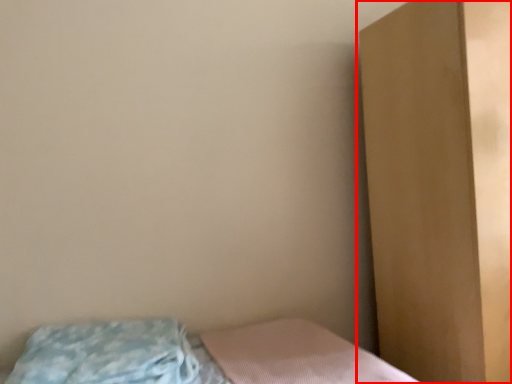
Question: From the image's perspective, what is the correct spatial positioning of dresser (annotated by the red box) in reference to pillow?

Choices:
 (A) below
 (B) above

Answer: (B)